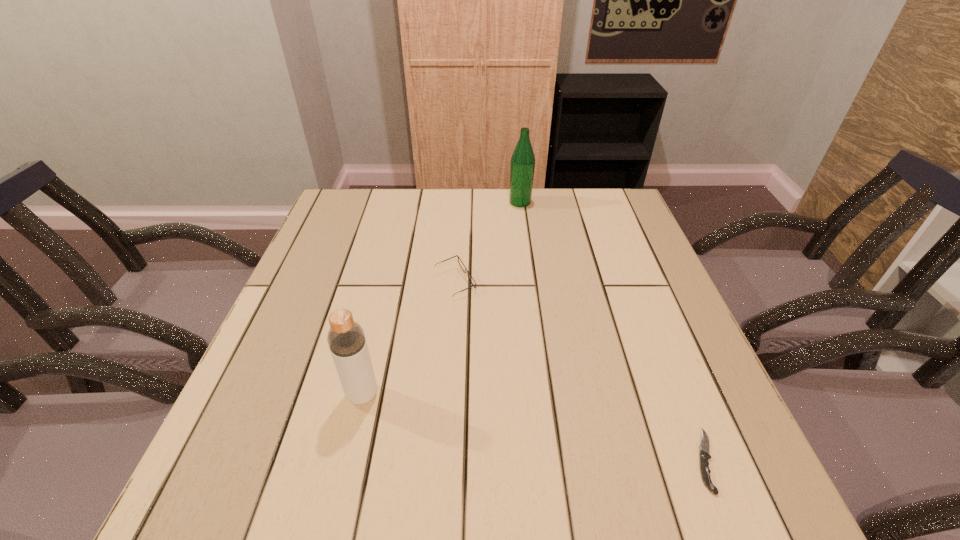
Locate an element on the screen. The image size is (960, 540). vacant point located between the farthest object and the second farthest object is located at coordinates (488, 242).

Identify which object is located as the second nearest to the second shortest object. Please provide its 2D coordinates. Your answer should be formatted as a tuple, i.e. [(x, y)], where the tuple contains the x and y coordinates of a point satisfying the conditions above.

[(522, 165)]

Locate which object is the closest to the farther bottle. Please provide its 2D coordinates. Your answer should be formatted as a tuple, i.e. [(x, y)], where the tuple contains the x and y coordinates of a point satisfying the conditions above.

[(460, 262)]

Find the location of `vacant space that satisfies the following two spatial constraints: 1. on the back side of the farthest object; 2. on the right side of the leftmost object`. vacant space that satisfies the following two spatial constraints: 1. on the back side of the farthest object; 2. on the right side of the leftmost object is located at coordinates (407, 202).

The width and height of the screenshot is (960, 540). In order to click on free location that satisfies the following two spatial constraints: 1. with the lenses facing outward on the second farthest object; 2. on the back side of the rightmost object in this screenshot , I will do pyautogui.click(x=444, y=460).

Locate an element on the screen. The image size is (960, 540). vacant area in the image that satisfies the following two spatial constraints: 1. on the back side of the third farthest object; 2. on the right side of the right bottle is located at coordinates (407, 202).